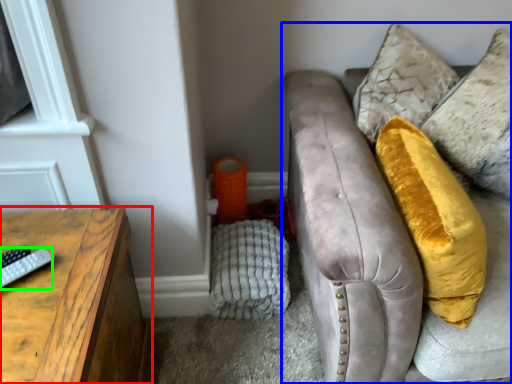
Question: Based on their relative distances, which object is nearer to table (highlighted by a red box)? Choose from studio couch (highlighted by a blue box) and remote (highlighted by a green box).

Choices:
 (A) studio couch
 (B) remote

Answer: (B)